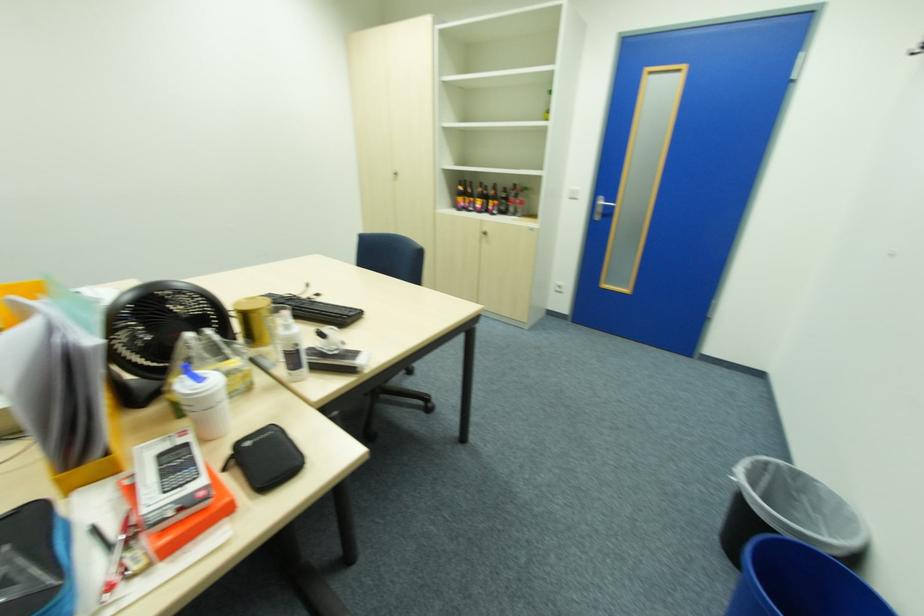
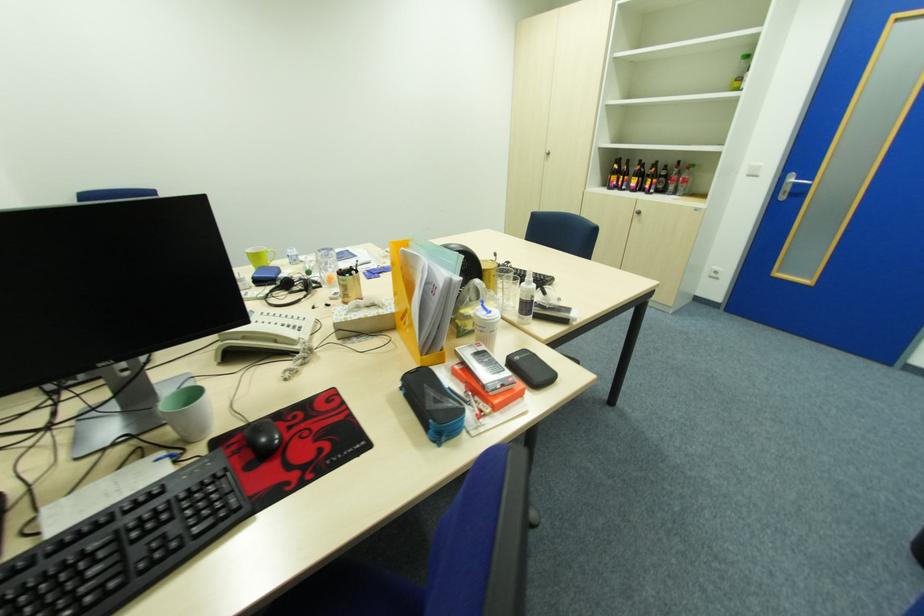
Question: How did the camera likely rotate?

Choices:
 (A) Left
 (B) Right
 (C) Up
 (D) Down

Answer: (A)